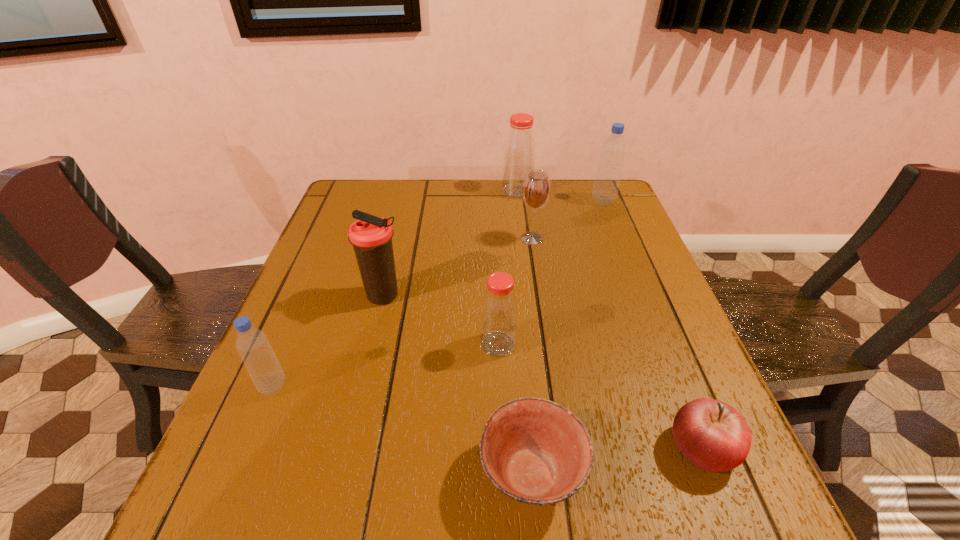
Identify the location of the bigger blue bottle. The width and height of the screenshot is (960, 540). (606, 185).

Where is `the right blue bottle`? Image resolution: width=960 pixels, height=540 pixels. the right blue bottle is located at coordinates (606, 185).

Identify the location of the bigger red bottle. (519, 155).

Image resolution: width=960 pixels, height=540 pixels. What are the coordinates of `the seventh object from right to left` in the screenshot? It's located at 371,236.

Where is `thermos bottle`? The width and height of the screenshot is (960, 540). thermos bottle is located at coordinates (371, 236).

Locate an element on the screen. red wineglass is located at coordinates (536, 191).

The width and height of the screenshot is (960, 540). I want to click on wineglass, so click(x=536, y=191).

The height and width of the screenshot is (540, 960). Identify the location of the smaller red bottle. (499, 308).

Find the location of a particular element. This screenshot has width=960, height=540. the third farthest bottle is located at coordinates (499, 308).

This screenshot has height=540, width=960. Find the location of `the left blue bottle`. the left blue bottle is located at coordinates (252, 344).